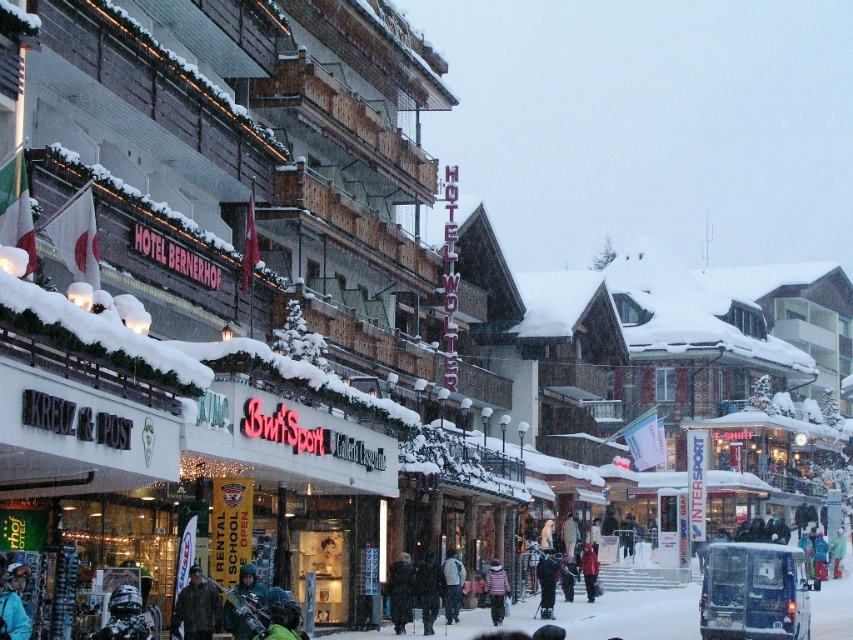
How much distance is there between dark brown leather jacket at center and red wool coat at center?

They are 168.18 feet apart.

The height and width of the screenshot is (640, 853). Identify the location of dark brown leather jacket at center. (196, 608).

This screenshot has width=853, height=640. What do you see at coordinates (196, 608) in the screenshot?
I see `dark brown leather jacket at center` at bounding box center [196, 608].

I want to click on dark brown leather jacket at center, so click(x=196, y=608).

Which is more to the right, dark brown leather jacket at center or striped wool sweater at center?

From the viewer's perspective, striped wool sweater at center appears more on the right side.

Who is more distant from viewer, [183,605] or [492,624]?

Point [492,624]

Is point (212, 598) more distant than point (494, 621)?

No, (212, 598) is closer to viewer.

This screenshot has height=640, width=853. I want to click on dark brown leather jacket at center, so click(x=196, y=608).

Does matte black ski equipment at center have a greater height compared to black fur coat at center?

In fact, matte black ski equipment at center may be shorter than black fur coat at center.

Can you confirm if matte black ski equipment at center is wider than black fur coat at center?

Yes, matte black ski equipment at center is wider than black fur coat at center.

What do you see at coordinates (250, 586) in the screenshot? The width and height of the screenshot is (853, 640). I see `matte black ski equipment at center` at bounding box center [250, 586].

Where is `matte black ski equipment at center`? Image resolution: width=853 pixels, height=640 pixels. matte black ski equipment at center is located at coordinates (250, 586).